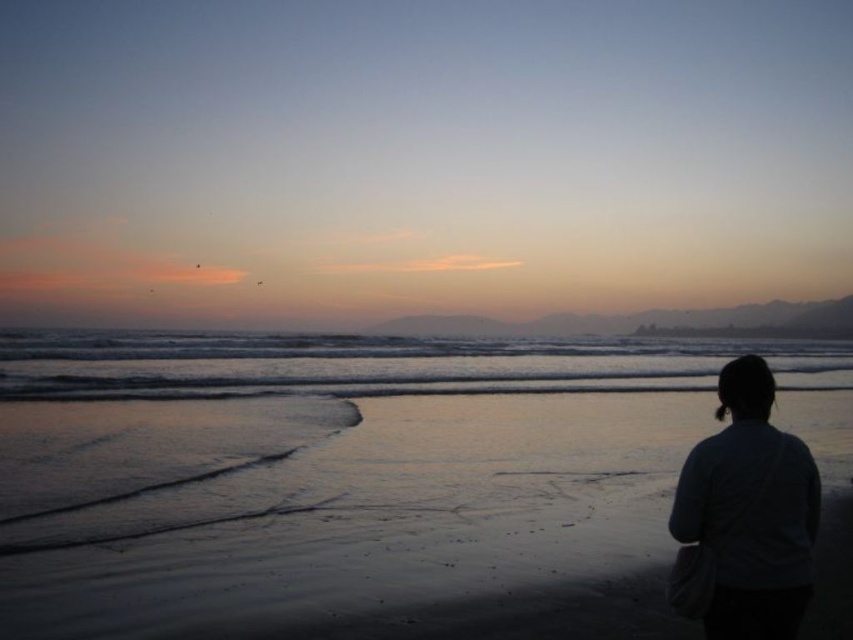
You are standing on the beach and want to walk from the shiny golden water at center to the dark gray sweater at lower right. Which direction should you walk to reach the sweater?

The dark gray sweater at lower right is located to the right side of the shiny golden water at center. Therefore, you should walk towards the right direction to reach the sweater.

You are standing on the beach and want to walk from the shiny golden water at center to the smooth sand at lower right. Which direction should you move?

The smooth sand at lower right is located above the shiny golden water at center, so you should move upward to reach it.

You are standing on the beach and want to walk from the shiny golden water at center to the smooth sand at lower right. Which direction should you face to walk directly towards your destination?

You should face to the right because the smooth sand at lower right is located to the right of the shiny golden water at center.